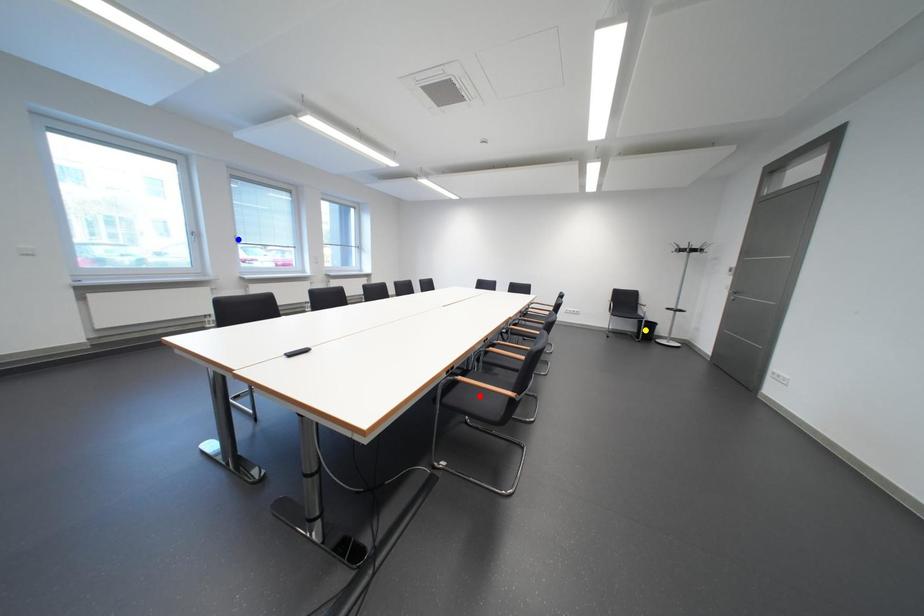
Order these from nearest to farthest:
yellow point | blue point | red point

blue point
yellow point
red point